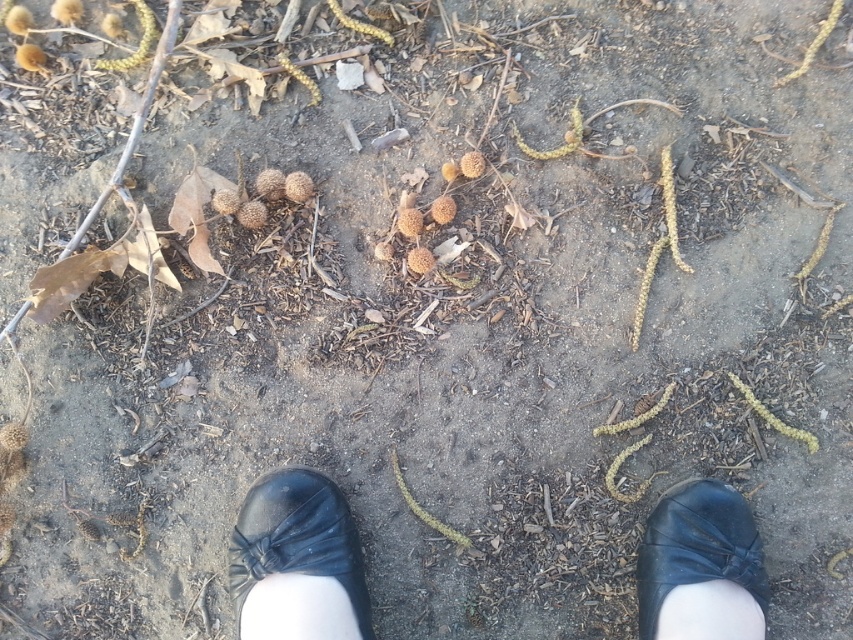
How much distance is there between black leather shoe at lower center and black leather shoe at lower right?

black leather shoe at lower center is 19.56 inches from black leather shoe at lower right.

Does black leather shoe at lower center have a smaller size compared to black leather shoe at lower right?

No.

The width and height of the screenshot is (853, 640). Find the location of `black leather shoe at lower center`. black leather shoe at lower center is located at coordinates (297, 540).

The width and height of the screenshot is (853, 640). I want to click on black leather shoe at lower center, so click(297, 540).

Is black leather shoes at center below black leather shoe at lower center?

Incorrect, black leather shoes at center is not positioned below black leather shoe at lower center.

The width and height of the screenshot is (853, 640). What do you see at coordinates (299, 557) in the screenshot? I see `black leather shoes at center` at bounding box center [299, 557].

The height and width of the screenshot is (640, 853). Find the location of `black leather shoes at center`. black leather shoes at center is located at coordinates (299, 557).

Does black leather shoes at center have a larger size compared to black leather shoe at lower right?

Correct, black leather shoes at center is larger in size than black leather shoe at lower right.

Is black leather shoes at center thinner than black leather shoe at lower right?

No, black leather shoes at center is not thinner than black leather shoe at lower right.

Is point (726, 536) positioned before point (683, 573)?

No.

At what (x,y) coordinates should I click in order to perform the action: click on black leather shoes at center. Please return your answer as a coordinate pair (x, y). The width and height of the screenshot is (853, 640). Looking at the image, I should click on (299, 557).